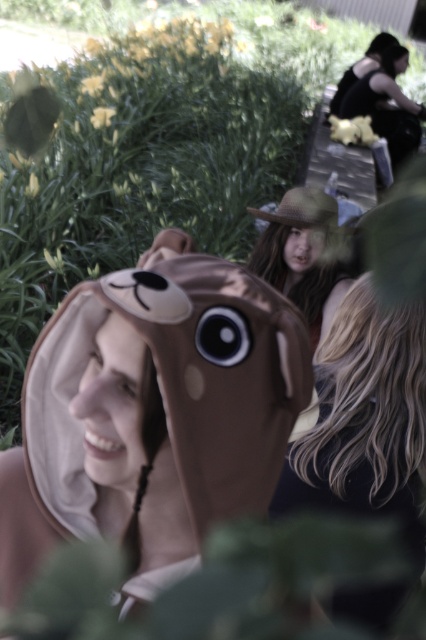
Question: Which object appears closest to the camera in this image?

Choices:
 (A) matte brown fur at upper right
 (B) black fabric woman at upper right

Answer: (B)

Question: Can you confirm if blonde hair at center is positioned to the right of black matte dress at upper right?

Choices:
 (A) yes
 (B) no

Answer: (B)

Question: Can you confirm if matte brown plush at center is positioned to the right of straw hat at upper center?

Choices:
 (A) no
 (B) yes

Answer: (A)

Question: Estimate the real-world distances between objects in this image. Which object is farther from the matte brown fur at upper right?

Choices:
 (A) smooth skin face at center
 (B) straw hat at upper center

Answer: (A)

Question: Does matte brown plush at center have a lesser width compared to smooth skin face at center?

Choices:
 (A) no
 (B) yes

Answer: (B)

Question: Which point is closer to the camera?

Choices:
 (A) (290, 257)
 (B) (400, 61)
 (C) (391, 440)
 (D) (337, 84)

Answer: (C)